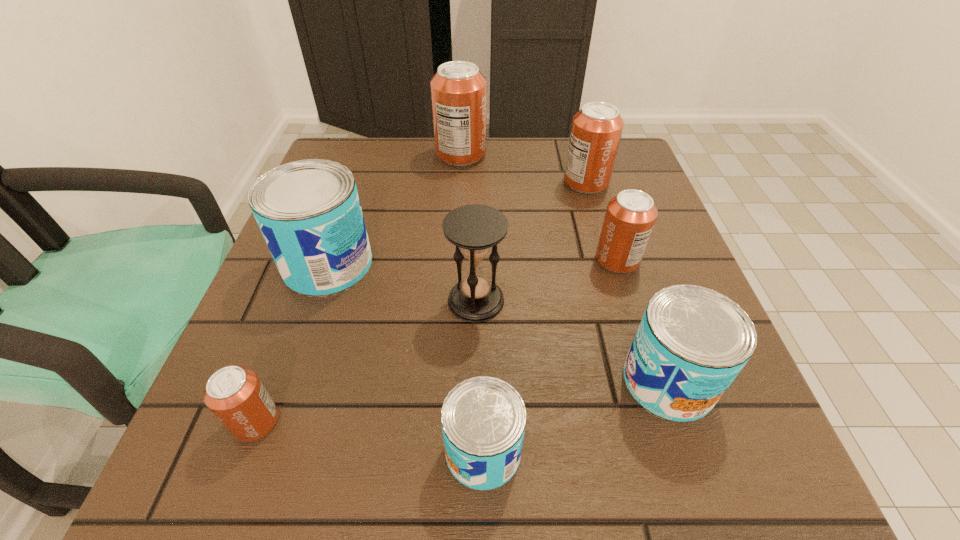
Where is `object at the near left corner`? This screenshot has width=960, height=540. object at the near left corner is located at coordinates (235, 395).

Identify the location of object that is positioned at the far right corner. The image size is (960, 540). (596, 130).

Locate an element on the screen. free space at the far edge is located at coordinates (434, 147).

Find the location of a particular element. free region at the near edge of the desktop is located at coordinates (510, 498).

In the image, there is a desktop. Identify the location of vacant space at the left edge. (317, 320).

The height and width of the screenshot is (540, 960). I want to click on vacant region at the right edge of the desktop, so click(608, 193).

Identify the location of vacant point at the far left corner. Image resolution: width=960 pixels, height=540 pixels. (349, 142).

Find the location of a particular element. vacant space at the near right corner is located at coordinates (748, 482).

Locate an element on the screen. This screenshot has height=540, width=960. vacant area that lies between the hourglass and the smallest orange can is located at coordinates (366, 361).

Locate an element on the screen. vacant region between the second blue can from left to right and the second smallest orange can is located at coordinates (550, 356).